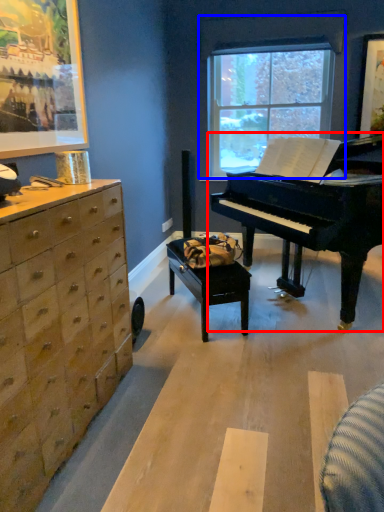
Question: Which object is closer to the camera taking this photo, piano (highlighted by a red box) or window (highlighted by a blue box)?

Choices:
 (A) piano
 (B) window

Answer: (A)